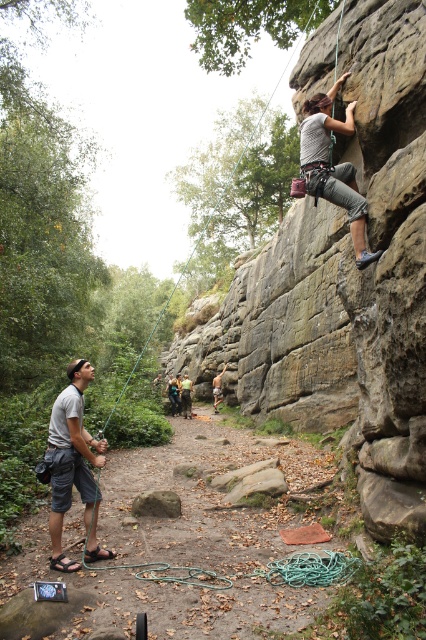
Who is positioned more to the left, gray fabric shirt at upper center or brown rough rock at center?

brown rough rock at center

Which is in front, point (356, 253) or point (175, 502)?

Point (356, 253) is in front.

At what (x,y) coordinates should I click in order to perform the action: click on gray fabric shirt at upper center. Please return your answer as a coordinate pair (x, y). Looking at the image, I should click on (333, 164).

Image resolution: width=426 pixels, height=640 pixels. I want to click on gray fabric shirt at upper center, so click(333, 164).

Find the location of a particular element. The width and height of the screenshot is (426, 640). gray fabric shirt at left is located at coordinates (72, 465).

Between gray fabric shirt at left and gray fabric shirt at upper center, which one is positioned lower?

Positioned lower is gray fabric shirt at left.

Who is more distant from viewer, (101, 449) or (357, 260)?

The point (101, 449) is more distant.

At what (x,y) coordinates should I click in order to perform the action: click on gray fabric shirt at left. Please return your answer as a coordinate pair (x, y). The image size is (426, 640). Looking at the image, I should click on (72, 465).

Who is higher up, gray fabric shirt at left or brown rough rock at center?

gray fabric shirt at left is higher up.

Is point (75, 360) positioned behind point (147, 502)?

Yes, it is.

The height and width of the screenshot is (640, 426). I want to click on gray fabric shirt at left, so click(72, 465).